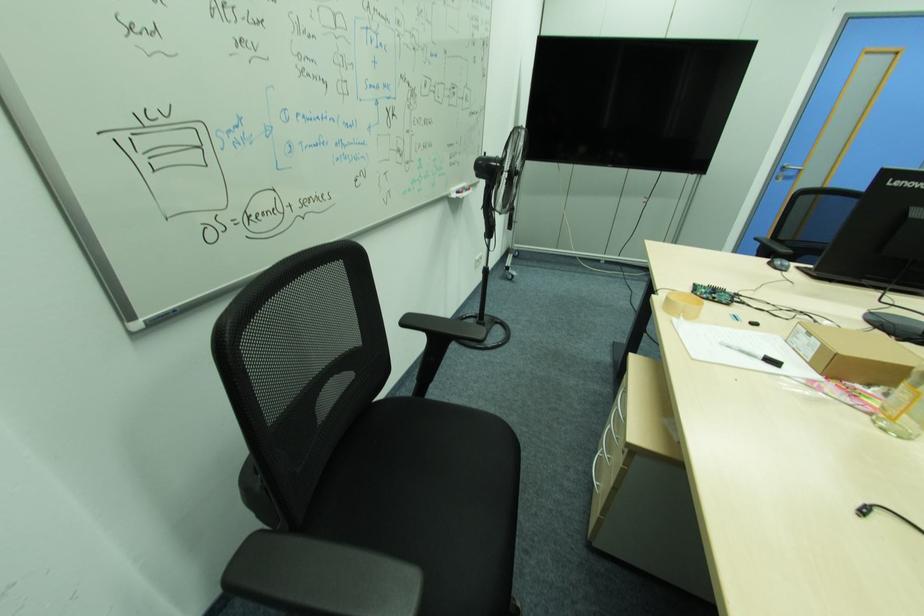
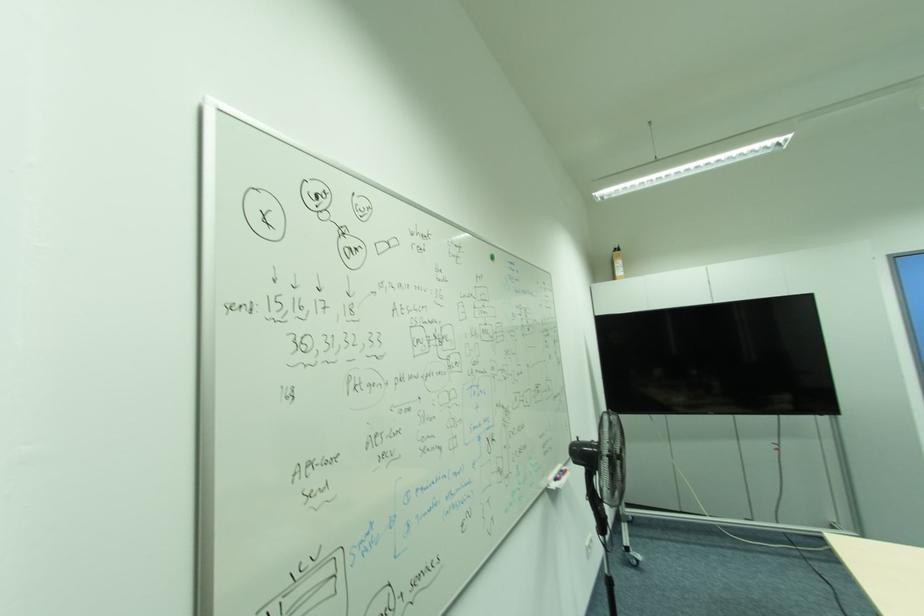
Question: The images are taken continuously from a first-person perspective. In which direction is your viewpoint rotating?

Choices:
 (A) Left
 (B) Right
 (C) Up
 (D) Down

Answer: (C)